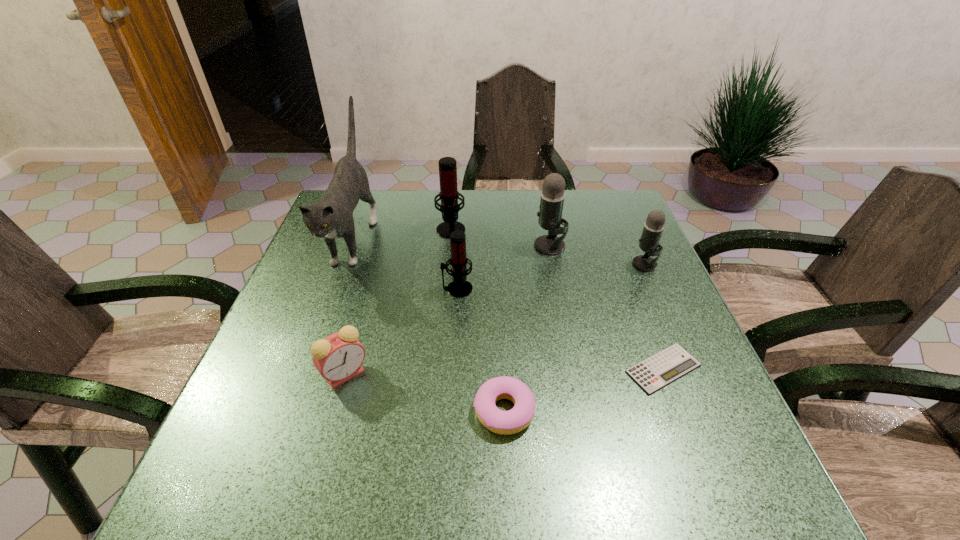
Where is `free spot located on the left of the calculator`? The height and width of the screenshot is (540, 960). free spot located on the left of the calculator is located at coordinates (481, 368).

At what (x,y) coordinates should I click in order to perform the action: click on cat situated at the far edge. Please return your answer as a coordinate pair (x, y). The image size is (960, 540). Looking at the image, I should click on [x=332, y=217].

Identify the location of microphone located at the far edge. The height and width of the screenshot is (540, 960). (449, 195).

Where is `cat located in the left edge section of the desktop`? This screenshot has height=540, width=960. cat located in the left edge section of the desktop is located at coordinates pos(332,217).

Identify the location of alarm clock that is positioned at the left edge. (339, 357).

The image size is (960, 540). In order to click on microphone located in the right edge section of the desktop in this screenshot , I will do `click(652, 231)`.

I want to click on calculator present at the right edge, so click(652, 374).

Find the location of a particular element. The height and width of the screenshot is (540, 960). object that is at the far left corner is located at coordinates (332, 217).

The width and height of the screenshot is (960, 540). In the image, there is a desktop. Identify the location of vacant space at the far edge. (574, 202).

In the image, there is a desktop. Where is `vacant space at the near edge`? This screenshot has height=540, width=960. vacant space at the near edge is located at coordinates (593, 491).